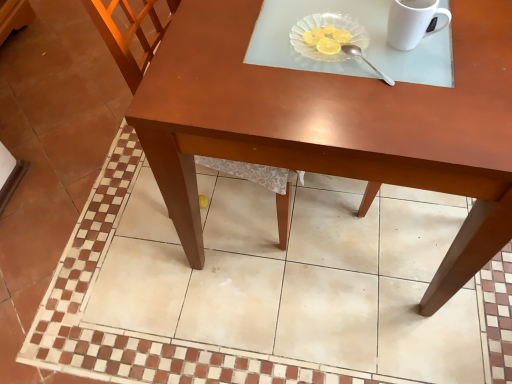
The width and height of the screenshot is (512, 384). Identify the location of vacant area situated to the left side of matte wood table at center. (70, 158).